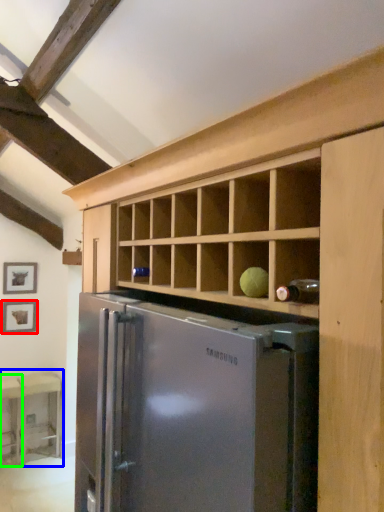
Question: Which is nearer to the picture frame (highlighted by a red box)? table (highlighted by a blue box) or table (highlighted by a green box).

Choices:
 (A) table
 (B) table

Answer: (B)